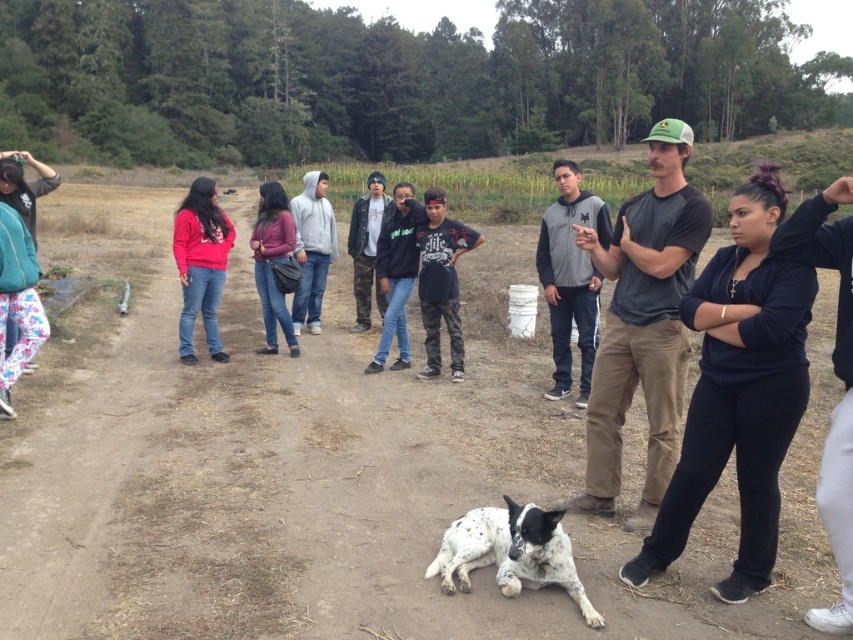
Question: Can you confirm if black matte hoodie at center is positioned below gray hoodie at center?

Choices:
 (A) no
 (B) yes

Answer: (B)

Question: Among these objects, which one is nearest to the camera?

Choices:
 (A) gray hoodie at center
 (B) dark gray hoodie at center

Answer: (B)

Question: Based on their relative distances, which object is nearer to the black camo pants at center?

Choices:
 (A) camouflage jacket at center
 (B) matte red hoodie at left
 (C) gray hoodie at center
 (D) dark gray hoodie at center

Answer: (A)

Question: Can you confirm if white spotted fur dog at center is smaller than black camo pants at center?

Choices:
 (A) no
 (B) yes

Answer: (A)

Question: Is matte red hoodie at left further to the viewer compared to black camo pants at center?

Choices:
 (A) no
 (B) yes

Answer: (B)

Question: Which object is closer to the camera taking this photo?

Choices:
 (A) dark gray hoodie at center
 (B) gray fleece jacket at center

Answer: (A)